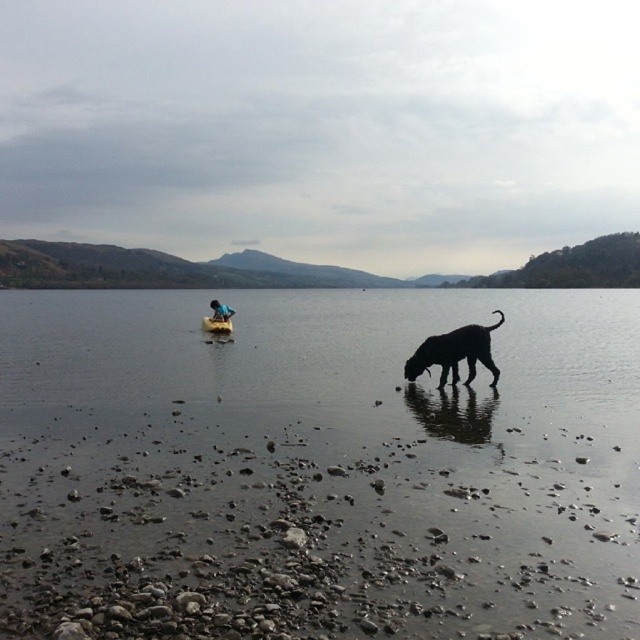
Can you confirm if black fur dog at lower center is positioned to the right of wooden canoe at center?

Correct, you'll find black fur dog at lower center to the right of wooden canoe at center.

Between point (445, 333) and point (224, 321), which one is positioned in front?

Positioned in front is point (445, 333).

Is point (442, 369) positioned after point (211, 330)?

No, (442, 369) is closer to viewer.

At what (x,y) coordinates should I click in order to perform the action: click on black fur dog at lower center. Please return your answer as a coordinate pair (x, y). Looking at the image, I should click on (454, 353).

Is wooden canoe at center below blue fabric at center?

Yes, wooden canoe at center is below blue fabric at center.

Does wooden canoe at center appear over blue fabric at center?

No.

Is point (204, 324) positioned before point (230, 314)?

No, it is not.

In order to click on wooden canoe at center in this screenshot , I will do pos(216,324).

From the picture: Who is positioned more to the left, clear water at shore center or blue fabric at center?

blue fabric at center

What do you see at coordinates (317, 467) in the screenshot? Image resolution: width=640 pixels, height=640 pixels. I see `clear water at shore center` at bounding box center [317, 467].

Find the location of a particular element. This screenshot has height=640, width=640. clear water at shore center is located at coordinates (317, 467).